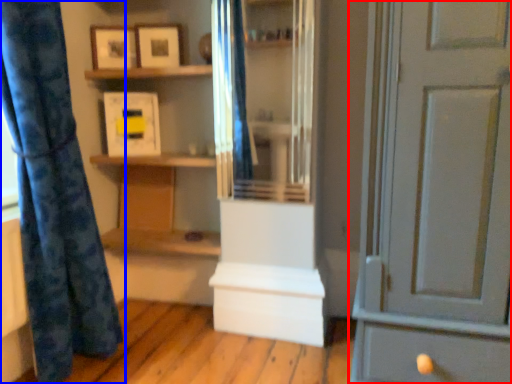
Question: Among these objects, which one is nearest to the camera, door (highlighted by a red box) or curtain (highlighted by a blue box)?

Choices:
 (A) door
 (B) curtain

Answer: (A)